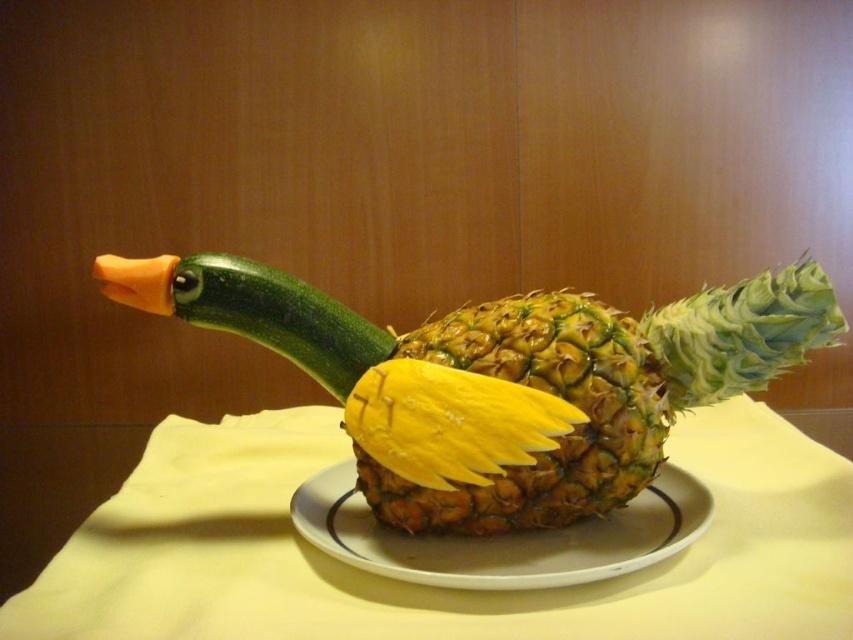
Is point (672, 320) positioned in front of point (653, 532)?

No, it is not.

Is yellow textured pineapple at center shorter than white ceramic plate at center?

In fact, yellow textured pineapple at center may be taller than white ceramic plate at center.

Find the location of a particular element. This screenshot has width=853, height=640. yellow textured pineapple at center is located at coordinates (602, 388).

At what (x,y) coordinates should I click in order to perform the action: click on yellow fabric at center. Please return your answer as a coordinate pair (x, y). The height and width of the screenshot is (640, 853). Looking at the image, I should click on (437, 588).

Which of these two, yellow fabric at center or yellow textured pineapple at center, stands taller?

yellow textured pineapple at center

I want to click on yellow fabric at center, so click(x=437, y=588).

Image resolution: width=853 pixels, height=640 pixels. Describe the element at coordinates (437, 588) in the screenshot. I see `yellow fabric at center` at that location.

Can you confirm if yellow fabric at center is positioned to the right of white ceramic plate at center?

Correct, you'll find yellow fabric at center to the right of white ceramic plate at center.

This screenshot has height=640, width=853. Describe the element at coordinates (437, 588) in the screenshot. I see `yellow fabric at center` at that location.

Find the location of a particular element. The height and width of the screenshot is (640, 853). yellow fabric at center is located at coordinates (437, 588).